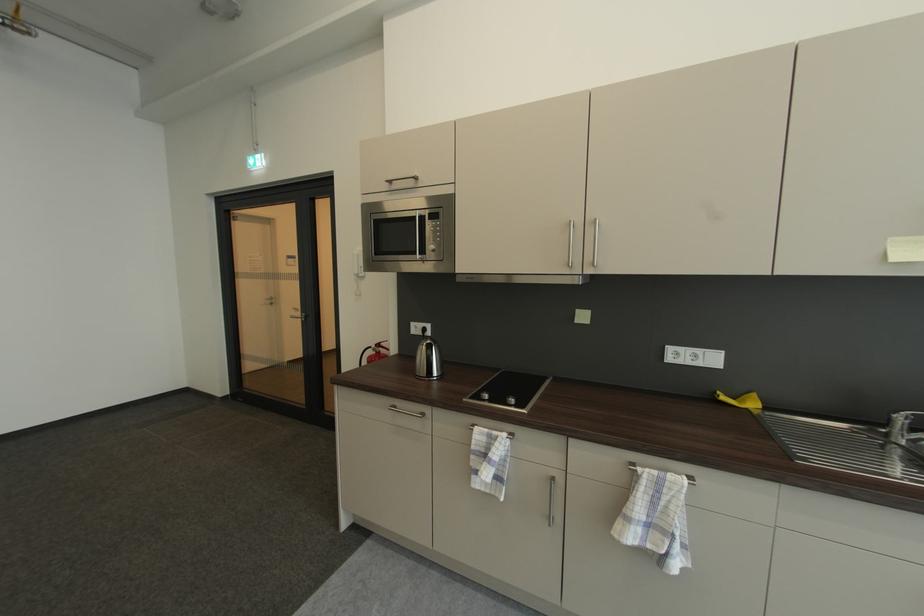
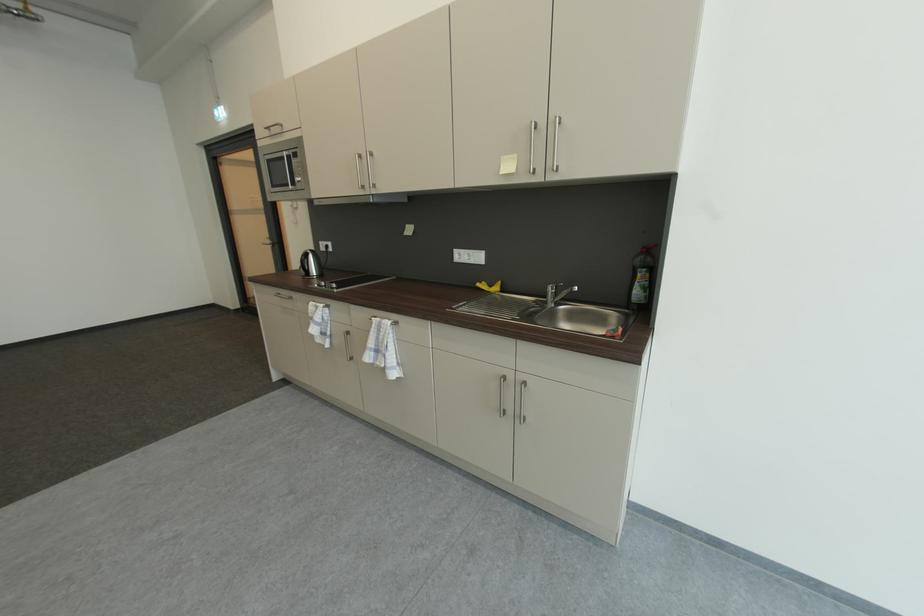
Locate, in the second image, the point that corresponds to point (421, 219) in the first image.

(290, 158)